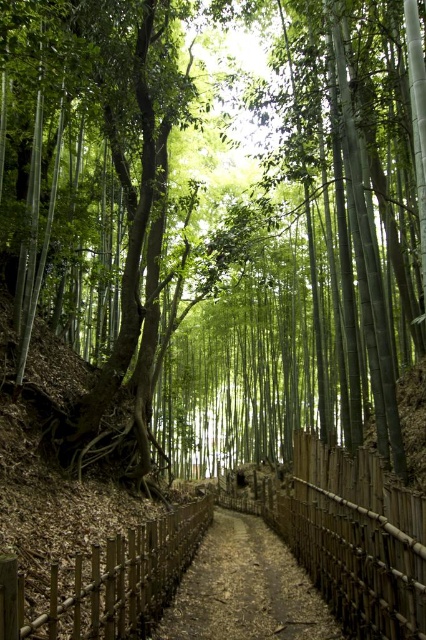
Question: Is the position of wooden fence at center more distant than that of brown wooden trail at center?

Choices:
 (A) no
 (B) yes

Answer: (A)

Question: Which object is the closest to the bamboo fence at center?

Choices:
 (A) brown wooden trail at center
 (B) wooden fence at center

Answer: (A)

Question: Does wooden fence at center have a lesser width compared to brown wooden trail at center?

Choices:
 (A) yes
 (B) no

Answer: (A)

Question: Which of the following is the farthest from the observer?

Choices:
 (A) (409, 602)
 (B) (232, 580)

Answer: (B)

Question: Can you confirm if bamboo fence at center is positioned below brown wooden trail at center?

Choices:
 (A) no
 (B) yes

Answer: (A)

Question: Which of the following is the farthest from the observer?

Choices:
 (A) (307, 564)
 (B) (281, 595)

Answer: (A)